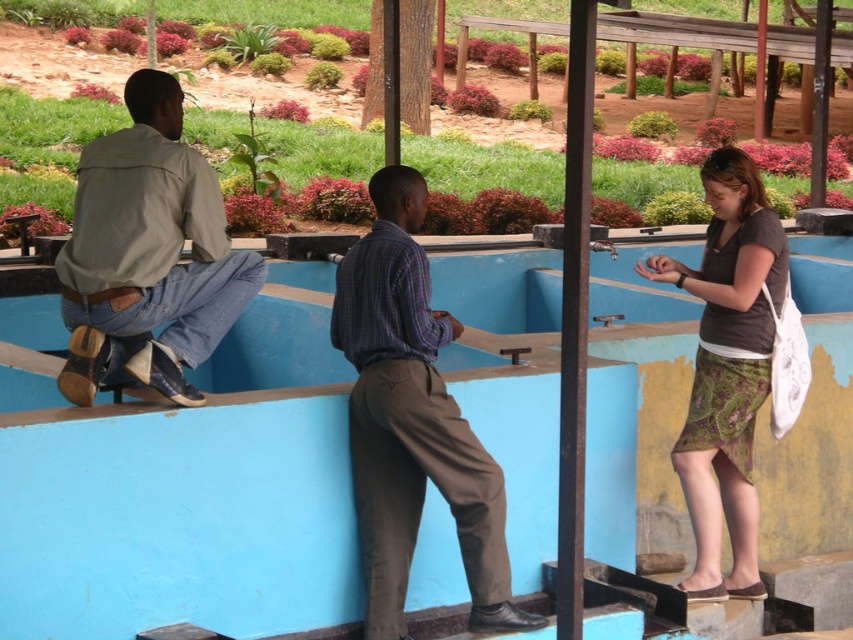
Does denim jeans at left come in front of green textured skirt at right?

Yes, it is.

Between denim jeans at left and green textured skirt at right, which one is positioned higher?

denim jeans at left

Which is behind, point (73, 253) or point (712, 556)?

The point (712, 556) is more distant.

This screenshot has width=853, height=640. In order to click on denim jeans at left in this screenshot , I will do `click(148, 253)`.

Based on the photo, can you confirm if plaid shirt at center is shorter than denim jeans at left?

No, plaid shirt at center is not shorter than denim jeans at left.

Does plaid shirt at center appear under denim jeans at left?

Correct, plaid shirt at center is located below denim jeans at left.

Does point (384, 500) come closer to viewer compared to point (202, 356)?

No.

You are a GUI agent. You are given a task and a screenshot of the screen. Output one action in this format:
    pyautogui.click(x=<x>, y=<y>)
    Task: Click on the plaid shirt at center
    The image size is (853, 640).
    Given the screenshot: What is the action you would take?
    pyautogui.click(x=412, y=420)

Which of these two, plaid shirt at center or green textured skirt at right, stands shorter?

With less height is plaid shirt at center.

Can you confirm if plaid shirt at center is taller than green textured skirt at right?

In fact, plaid shirt at center may be shorter than green textured skirt at right.

The width and height of the screenshot is (853, 640). Describe the element at coordinates (412, 420) in the screenshot. I see `plaid shirt at center` at that location.

Find the location of a particular element. plaid shirt at center is located at coordinates (412, 420).